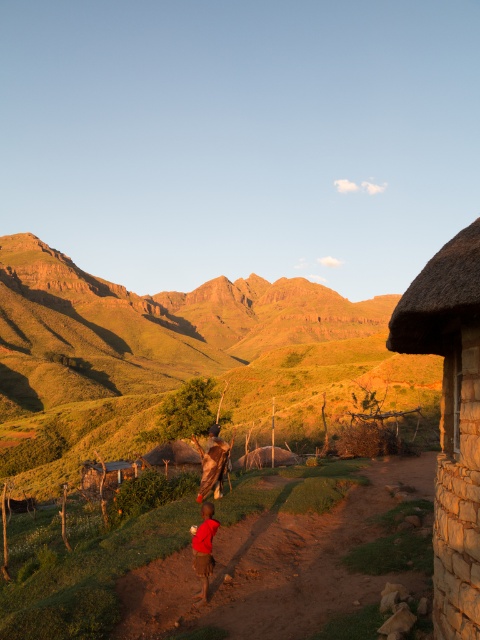
Question: Among these objects, which one is nearest to the camera?

Choices:
 (A) thatched straw hut at right
 (B) brown dirt path at lower center

Answer: (A)

Question: Which of the following is the closest to the observer?

Choices:
 (A) (206, 465)
 (B) (223, 337)
 (C) (267, 595)

Answer: (C)

Question: Considering the relative positions of green grassy mountain at upper left and red cotton shirt at center in the image provided, where is green grassy mountain at upper left located with respect to red cotton shirt at center?

Choices:
 (A) right
 (B) left

Answer: (B)

Question: Which point is closer to the camera?

Choices:
 (A) (204, 492)
 (B) (202, 595)
 (C) (12, 369)

Answer: (B)

Question: Is thatched straw hut at right to the right of red cotton shirt at center from the viewer's perspective?

Choices:
 (A) yes
 (B) no

Answer: (A)

Question: Does green grassy mountain at upper left have a larger size compared to brown dirt path at lower center?

Choices:
 (A) no
 (B) yes

Answer: (B)